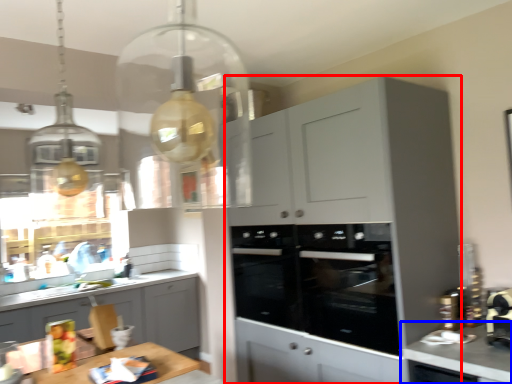
Question: Among these objects, which one is nearest to the camera, cabinetry (highlighted by a red box) or countertop (highlighted by a blue box)?

Choices:
 (A) cabinetry
 (B) countertop

Answer: (B)